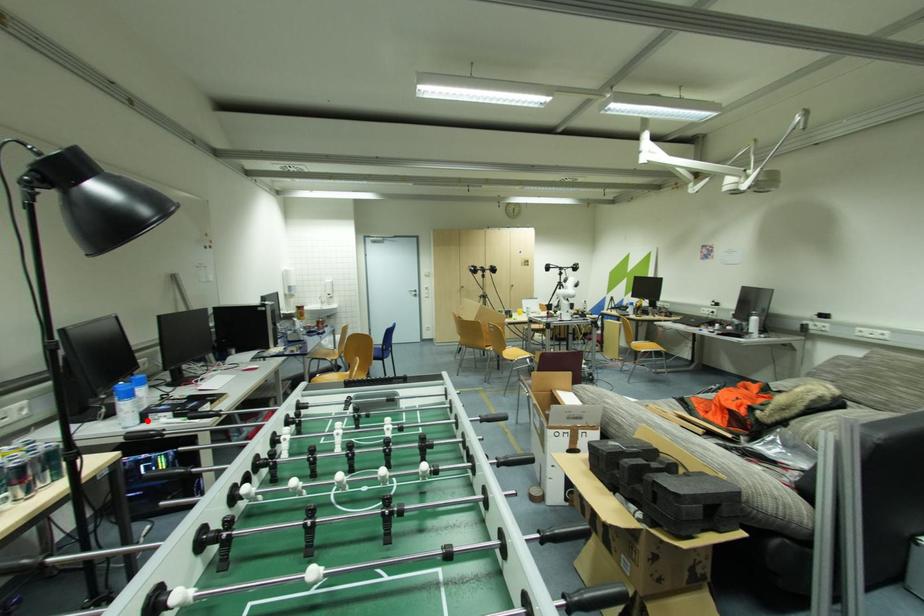
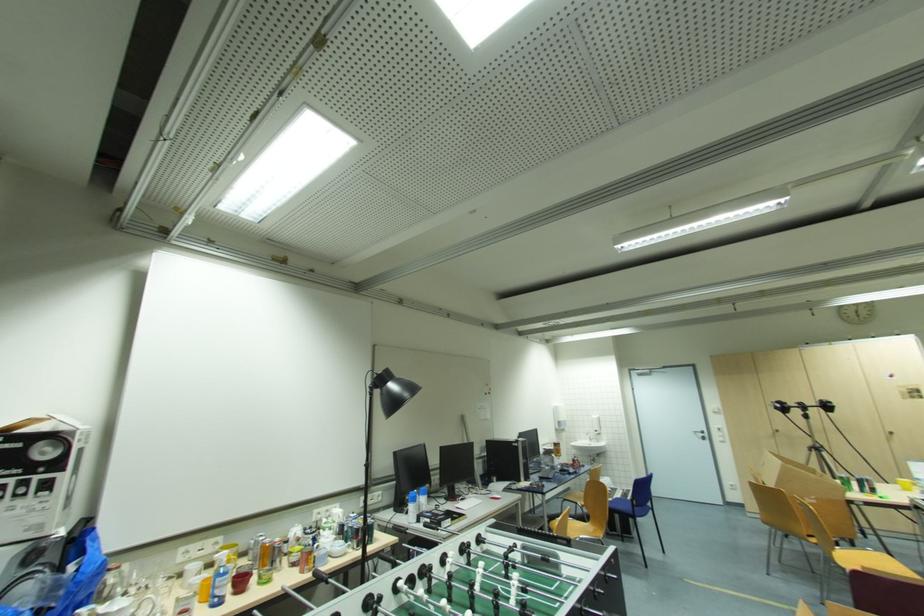
Question: I am providing you with two images of the same scene from different viewpoints. In image1, a red point is highlighted. Considering the same 3D point in image2, which of the following is correct?

Choices:
 (A) It is closer
 (B) It is farther

Answer: (B)